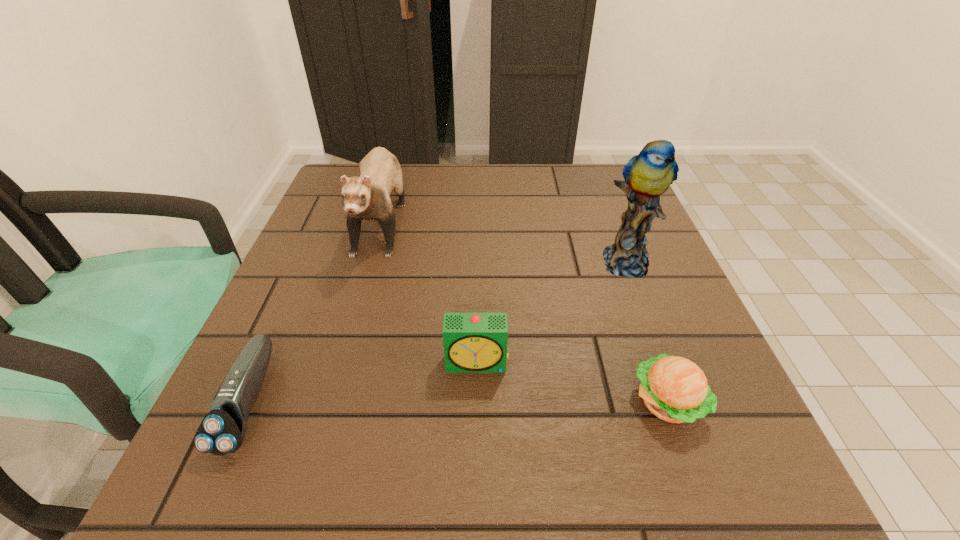
Where is `free space between the second tallest object and the third shortest object`? free space between the second tallest object and the third shortest object is located at coordinates (430, 289).

Where is `unoccupied area between the third shortest object and the electric shaver`? unoccupied area between the third shortest object and the electric shaver is located at coordinates (363, 382).

The image size is (960, 540). In order to click on vacant area between the fourth shortest object and the alarm clock in this screenshot , I will do `click(430, 289)`.

The height and width of the screenshot is (540, 960). Identify the location of empty space between the parrot and the fourth shortest object. (504, 239).

Find the location of a particular element. Image resolution: width=960 pixels, height=540 pixels. free space between the shortest object and the hamburger is located at coordinates (459, 402).

Locate an element on the screen. This screenshot has height=540, width=960. empty location between the third tallest object and the parrot is located at coordinates (552, 313).

Where is `the fourth closest object relative to the hamburger`? Image resolution: width=960 pixels, height=540 pixels. the fourth closest object relative to the hamburger is located at coordinates (222, 430).

The image size is (960, 540). I want to click on object that stands as the third closest to the hamburger, so coord(367,197).

Identify the location of blank area in the image that satisfies the following two spatial constraints: 1. on the head of the shortest object; 2. on the left side of the hamburger. (249, 402).

This screenshot has height=540, width=960. I want to click on free space that satisfies the following two spatial constraints: 1. on the head of the hamburger; 2. on the left side of the leftmost object, so click(249, 402).